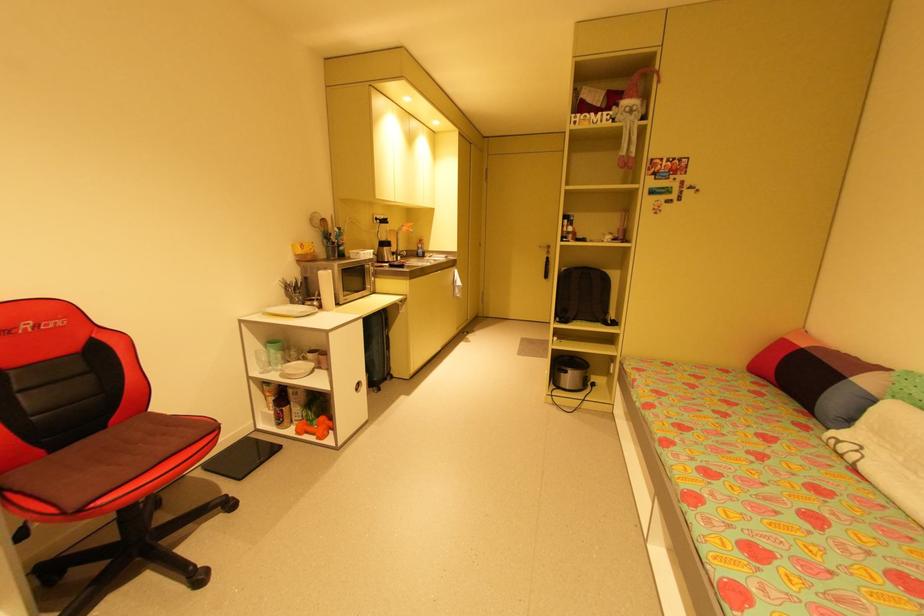
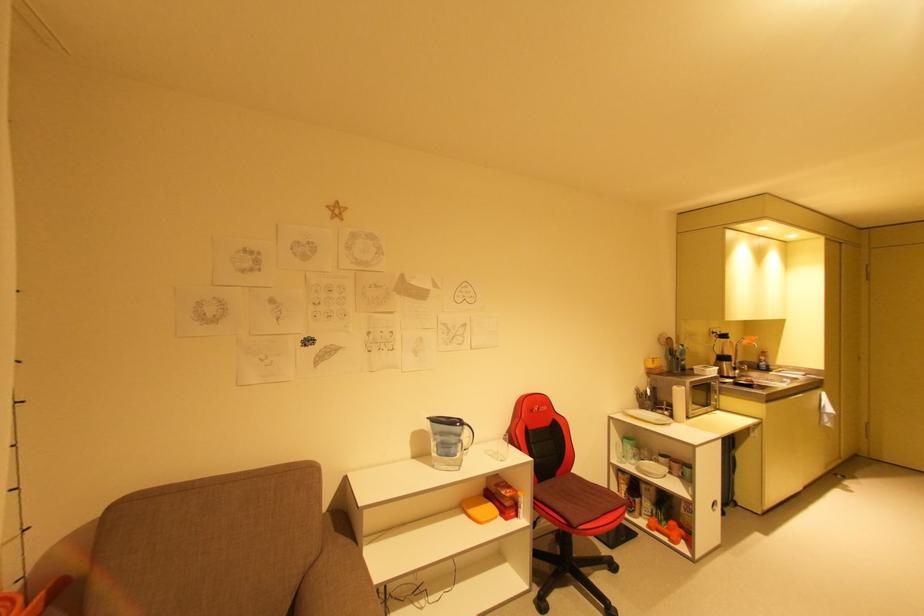
In the second image, find the point that corresponds to [430,257] in the first image.

(776, 373)